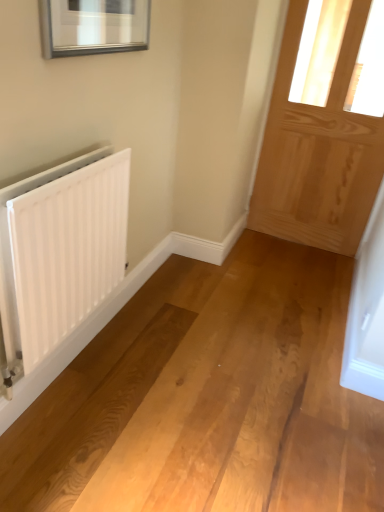
Question: From a real-world perspective, is natural wood door at right located beneath white matte radiator at left?

Choices:
 (A) no
 (B) yes

Answer: (A)

Question: From the image's perspective, is natural wood door at right on top of white matte radiator at left?

Choices:
 (A) yes
 (B) no

Answer: (A)

Question: Does natural wood door at right appear on the left side of white matte radiator at left?

Choices:
 (A) no
 (B) yes

Answer: (A)

Question: Is natural wood door at right not within white matte radiator at left?

Choices:
 (A) yes
 (B) no

Answer: (A)

Question: Considering the relative sizes of natural wood door at right and white matte radiator at left in the image provided, is natural wood door at right thinner than white matte radiator at left?

Choices:
 (A) no
 (B) yes

Answer: (A)

Question: Can you confirm if natural wood door at right is smaller than white matte radiator at left?

Choices:
 (A) yes
 (B) no

Answer: (B)

Question: From a real-world perspective, is white matte radiator at left physically above natural wood door at right?

Choices:
 (A) yes
 (B) no

Answer: (B)

Question: Is white matte radiator at left positioned beyond the bounds of natural wood door at right?

Choices:
 (A) no
 (B) yes

Answer: (B)

Question: From the image's perspective, does white matte radiator at left appear lower than natural wood door at right?

Choices:
 (A) no
 (B) yes

Answer: (B)

Question: Is white matte radiator at left looking in the opposite direction of natural wood door at right?

Choices:
 (A) yes
 (B) no

Answer: (B)

Question: Considering the relative sizes of white matte radiator at left and natural wood door at right in the image provided, is white matte radiator at left smaller than natural wood door at right?

Choices:
 (A) no
 (B) yes

Answer: (B)

Question: Does white matte radiator at left come behind natural wood door at right?

Choices:
 (A) no
 (B) yes

Answer: (A)

Question: Looking at their shapes, would you say white matte radiator at left is wider or thinner than natural wood door at right?

Choices:
 (A) wide
 (B) thin

Answer: (B)